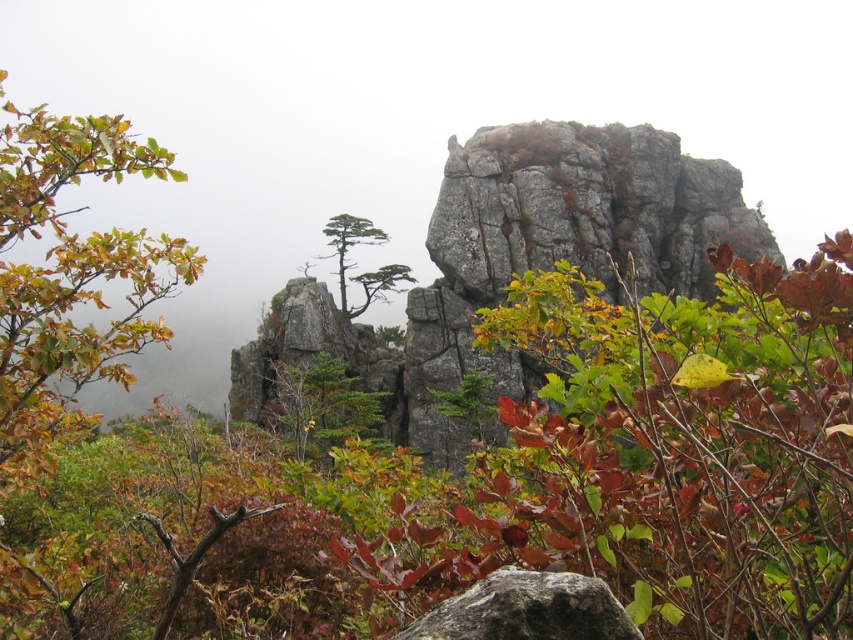
You are a hiker trying to navigate through this mountainous area. You see a green leafy shrub at center and a gray rough boulder at center. Which object would block your view more if you were to walk directly towards them?

The green leafy shrub at center is much taller than the gray rough boulder at center, so it would block your view more when walking towards them.

You are a hiker standing at the base of the mountain and looking at two points marked in the image. The first point is at coordinate point (68, 616) and the second is at point (561, 620). Which point is closer to you?

Point (68, 616) is closer to you because it is further to the viewer than point (561, 620).

You are a hiker trying to navigate through the mountainous area shown in the image. You need to pass between the green leafy shrub at center and the green matte tree at center. Can you estimate whether the space between them is wide enough for a standard backpack? Please consider their widths as described.

The green leafy shrub at center is wider than the green matte tree at center. Since the shrub is wider, the space between them might be narrower than the tree alone. However, without specific distance data between them, it is hard to determine if it is wide enough for a standard backpack. You might need to check the actual space on site.